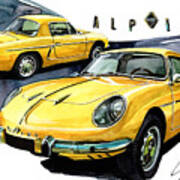
This screenshot has width=180, height=180. Find the location of `hood`. hood is located at coordinates (63, 114), (22, 107), (75, 93), (48, 89).